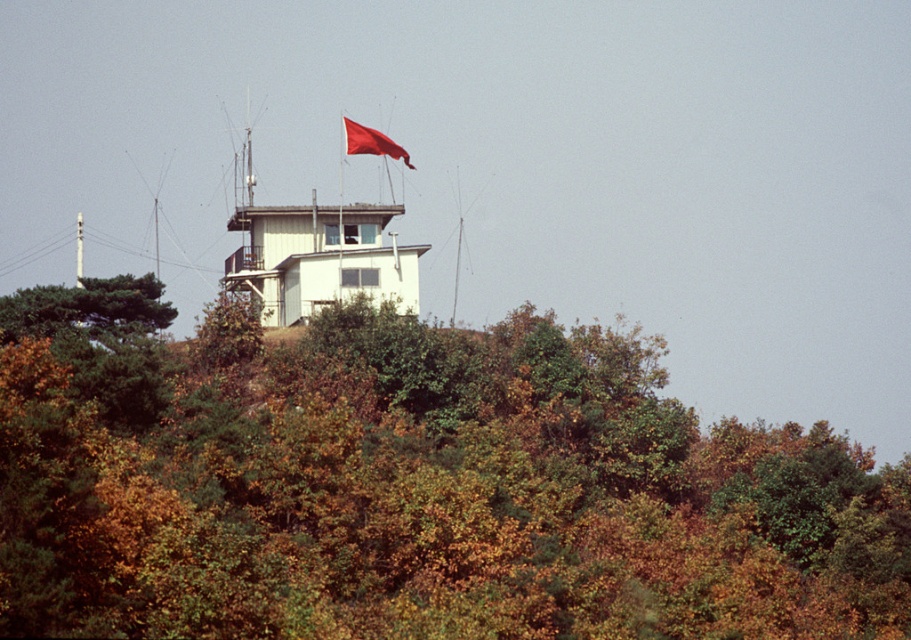
Can you confirm if green matte tree at upper center is positioned below red fabric flag at upper center?

Yes.

Does point (239, 582) come closer to viewer compared to point (367, 145)?

Yes, point (239, 582) is closer to viewer.

Which is in front, point (254, 532) or point (369, 131)?

Point (254, 532) is more forward.

I want to click on green matte tree at upper center, so click(x=413, y=486).